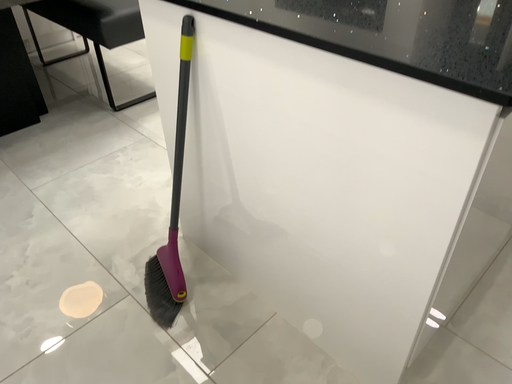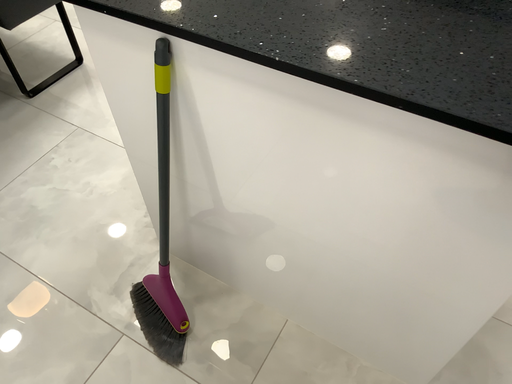
Question: Which way did the camera rotate in the video?

Choices:
 (A) rotated downward
 (B) rotated upward

Answer: (A)